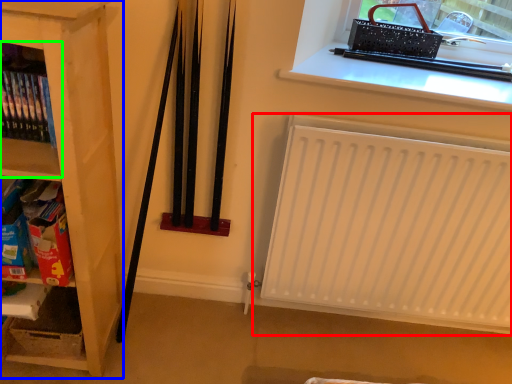
Question: Which object is positioned farthest from heater (highlighted by a red box)? Select from shelf (highlighted by a blue box) and shelf (highlighted by a green box).

Choices:
 (A) shelf
 (B) shelf

Answer: (B)